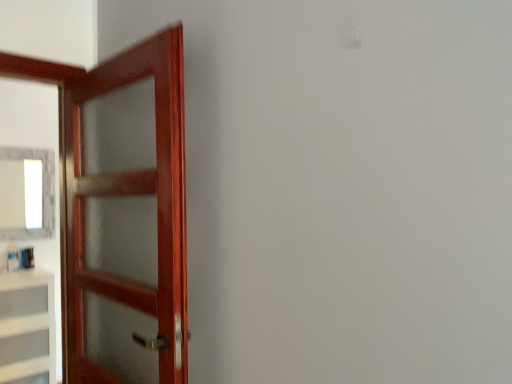
Question: Considering the positions of white matte cabinet at left and white glossy mirror at upper left in the image, is white matte cabinet at left taller or shorter than white glossy mirror at upper left?

Choices:
 (A) short
 (B) tall

Answer: (B)

Question: Do you think white matte cabinet at left is within white glossy mirror at upper left, or outside of it?

Choices:
 (A) outside
 (B) inside

Answer: (A)

Question: Based on their relative distances, which object is nearer to the white glossy mirror at upper left?

Choices:
 (A) mahogany wood door at left
 (B) white matte cabinet at left

Answer: (B)

Question: Which object is positioned farthest from the white matte cabinet at left?

Choices:
 (A) mahogany wood door at left
 (B) white glossy mirror at upper left

Answer: (A)